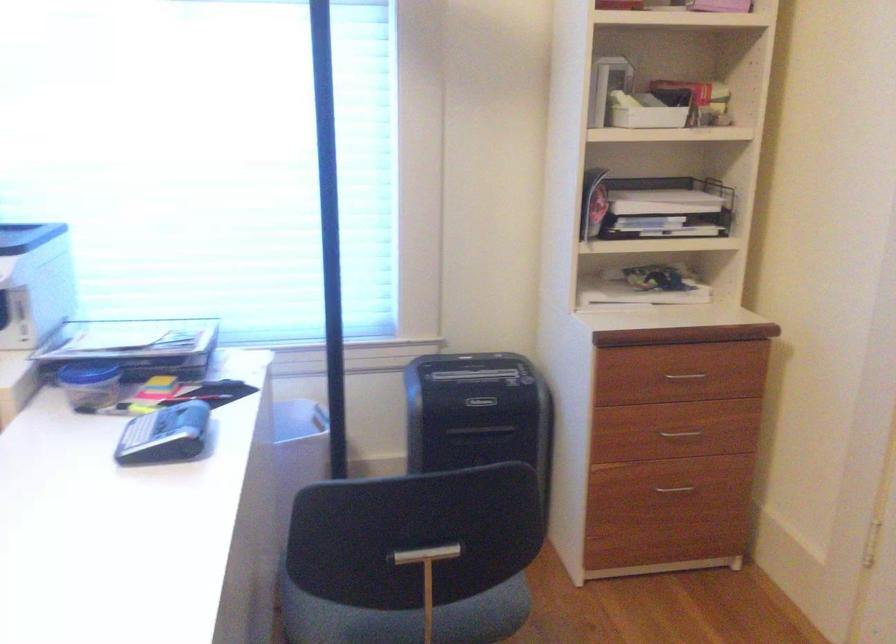
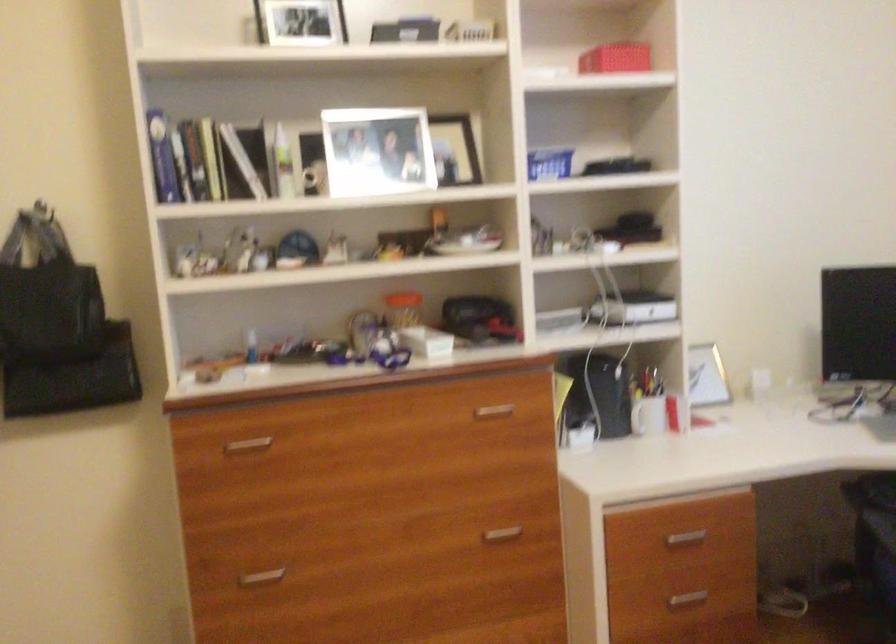
Question: The camera is either moving clockwise (left) or counter-clockwise (right) around the object. The first image is from the beginning of the video and the second image is from the end. Is the camera moving left or right when shooting the video?

Choices:
 (A) Left
 (B) Right

Answer: (B)